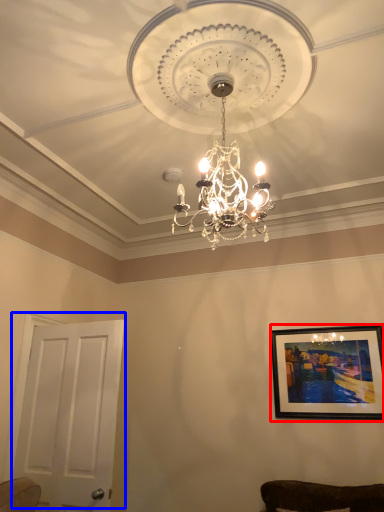
Question: Which of the following is the closest to the observer, picture frame (highlighted by a red box) or door (highlighted by a blue box)?

Choices:
 (A) picture frame
 (B) door

Answer: (B)